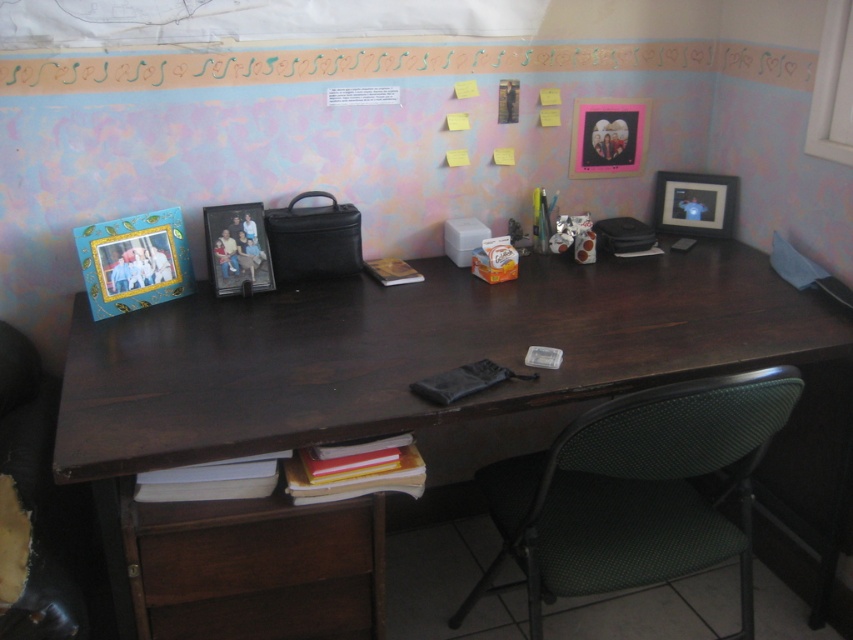
Is dark wood computer desk at center positioned at the back of matte plastic picture frame at center?

No, it is not.

Can you confirm if dark wood computer desk at center is positioned below matte plastic picture frame at center?

Correct, dark wood computer desk at center is located below matte plastic picture frame at center.

Who is more distant from viewer, (387, 371) or (265, 278)?

The point (265, 278) is behind.

Where is `dark wood computer desk at center`? This screenshot has width=853, height=640. dark wood computer desk at center is located at coordinates (399, 358).

Is dark wood computer desk at center above matte black picture frame at upper right?

Actually, dark wood computer desk at center is below matte black picture frame at upper right.

Which is more to the left, dark wood computer desk at center or matte black picture frame at upper right?

Positioned to the left is dark wood computer desk at center.

Is point (125, 576) more distant than point (668, 216)?

No, (125, 576) is in front of (668, 216).

Where is `dark wood computer desk at center`? This screenshot has width=853, height=640. dark wood computer desk at center is located at coordinates (399, 358).

In the scene shown: Can you confirm if dark wood computer desk at center is positioned above pink matte picture frame at upper right?

Incorrect, dark wood computer desk at center is not positioned above pink matte picture frame at upper right.

Which is in front, point (212, 312) or point (642, 131)?

Point (212, 312) is in front.

Does point (183, 436) come closer to viewer compared to point (572, 157)?

Yes, point (183, 436) is closer to viewer.

Locate an element on the screen. The height and width of the screenshot is (640, 853). dark wood computer desk at center is located at coordinates (399, 358).